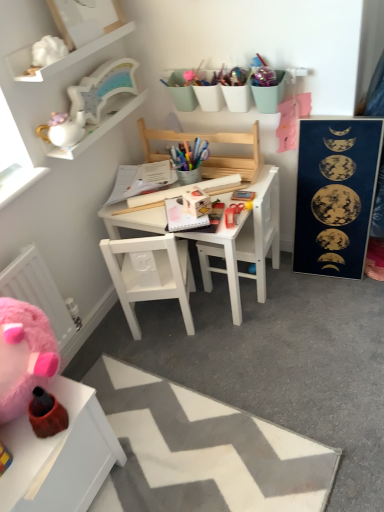
Where is `blank area beneath white matte chair at center, acting as the 2th chair starting from the top (from a real-world perspective)`? blank area beneath white matte chair at center, acting as the 2th chair starting from the top (from a real-world perspective) is located at coordinates (160, 324).